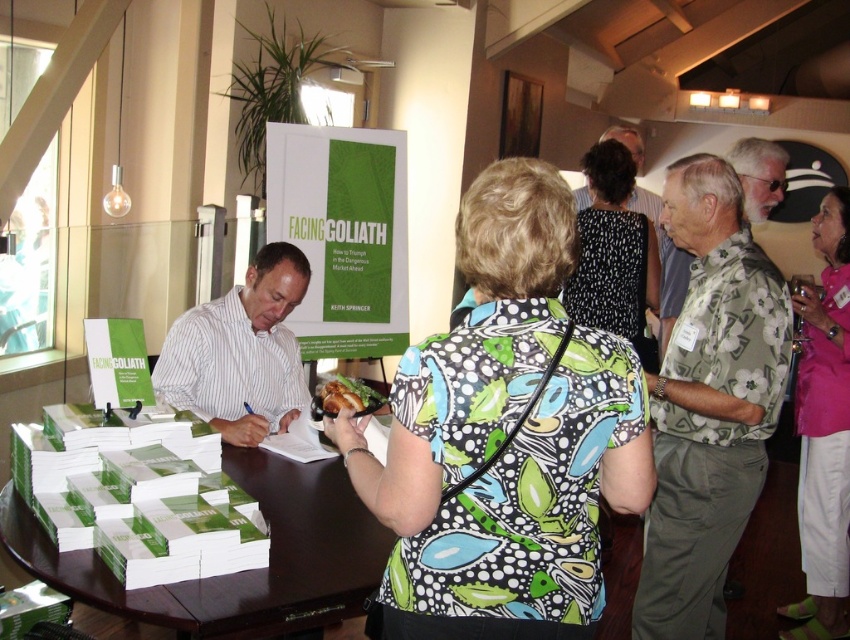
Between printed fabric blouse at center and pink fabric shirt at upper right, which one has more height?

With more height is pink fabric shirt at upper right.

Which is behind, point (621, 472) or point (819, 237)?

Point (819, 237)

Where is `printed fabric blouse at center`? This screenshot has width=850, height=640. printed fabric blouse at center is located at coordinates [x=503, y=436].

The width and height of the screenshot is (850, 640). Find the location of `green paper stacks at center`. green paper stacks at center is located at coordinates (234, 573).

The width and height of the screenshot is (850, 640). What are the coordinates of `green paper stacks at center` in the screenshot? It's located at (234, 573).

The height and width of the screenshot is (640, 850). What do you see at coordinates (241, 353) in the screenshot?
I see `white striped shirt at left` at bounding box center [241, 353].

Which is more to the right, white striped shirt at left or black dotted dress at center?

Positioned to the right is black dotted dress at center.

Measure the distance between white striped shirt at left and camera.

white striped shirt at left and camera are 7.74 feet apart.

Find the location of `white striped shirt at left`. white striped shirt at left is located at coordinates (241, 353).